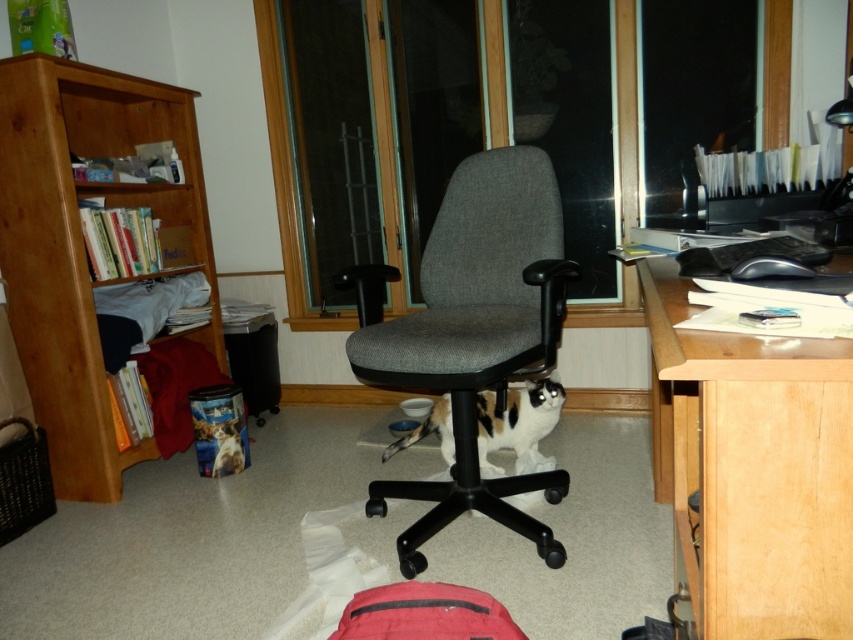
Consider the image. You are a visitor in this office and want to pet the calico fur cat at center. To reach the cat, you need to move around the gray fabric swivel chair at center. Which direction should you move relative to the chair to approach the cat?

The gray fabric swivel chair at center is located above the calico fur cat at center, so the cat is below the chair. To approach the cat, you should move downward or behind the chair towards the lower area where the cat is positioned.

You are a delivery person entering the room and need to place a package on the gray fabric swivel chair at center without disturbing the calico fur cat at center. Can you do this easily?

The gray fabric swivel chair at center is closer to the viewer than the calico fur cat at center, so you can place the package on the gray fabric swivel chair at center without needing to move the cat since it is farther away.